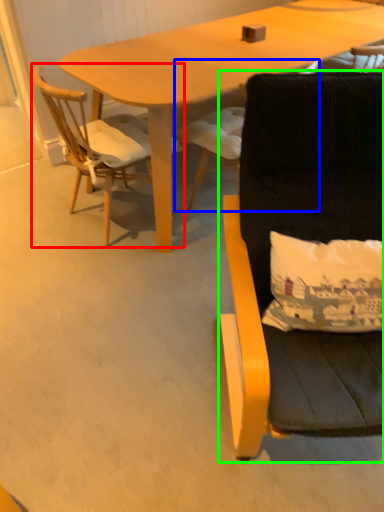
Question: Which is nearer to the chair (highlighted by a red box)? chair (highlighted by a blue box) or chair (highlighted by a green box).

Choices:
 (A) chair
 (B) chair

Answer: (A)